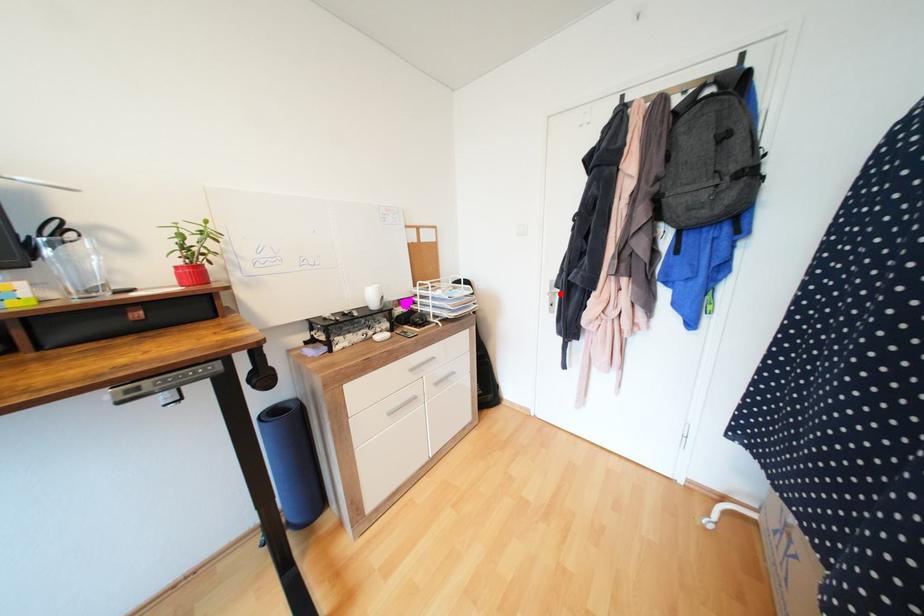
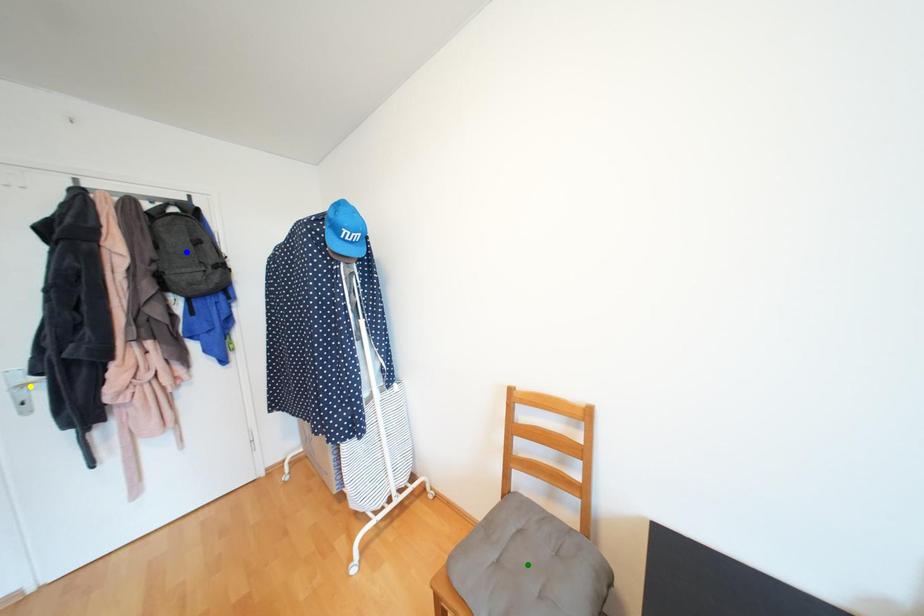
Question: I am providing you with two images of the same scene from different viewpoints. A red point is marked on the first image. You are given multiple points on the second image. Which mark in image 2 goes with the point in image 1?

Choices:
 (A) green point
 (B) blue point
 (C) yellow point

Answer: (C)